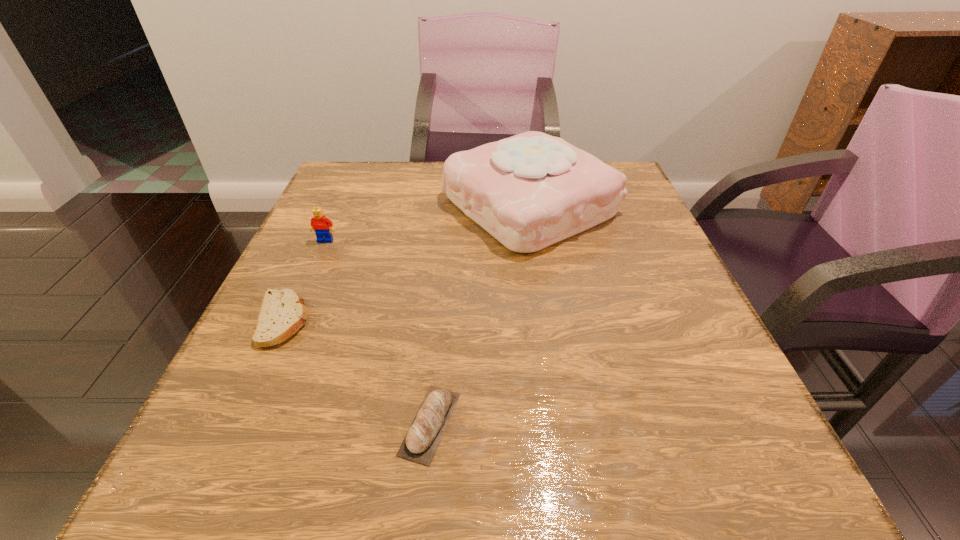
This screenshot has width=960, height=540. I want to click on free space at the near left corner, so click(x=242, y=484).

Find the location of `vacant space at the near right corner of the desktop`. vacant space at the near right corner of the desktop is located at coordinates (668, 481).

The height and width of the screenshot is (540, 960). In order to click on vacant space that is in between the left pita bread and the Lego in this screenshot , I will do `click(304, 281)`.

Where is `blank region between the second shortest object and the second tallest object`? The image size is (960, 540). blank region between the second shortest object and the second tallest object is located at coordinates [x=378, y=332].

The image size is (960, 540). I want to click on vacant area that lies between the farther pita bread and the taller pita bread, so click(x=356, y=372).

Locate an element on the screen. Image resolution: width=960 pixels, height=540 pixels. vacant area that lies between the nearer pita bread and the tallest object is located at coordinates (480, 314).

Image resolution: width=960 pixels, height=540 pixels. I want to click on empty space that is in between the third shortest object and the cake, so click(427, 223).

The width and height of the screenshot is (960, 540). Identify the location of empty space between the Lego and the nearer pita bread. (378, 332).

Where is `vacant space that is in between the cake and the shorter pita bread`? The width and height of the screenshot is (960, 540). vacant space that is in between the cake and the shorter pita bread is located at coordinates (406, 262).

At what (x,y) coordinates should I click in order to perform the action: click on unoccupied area between the farther pita bread and the Lego. Please return your answer as a coordinate pair (x, y). Looking at the image, I should click on (304, 281).